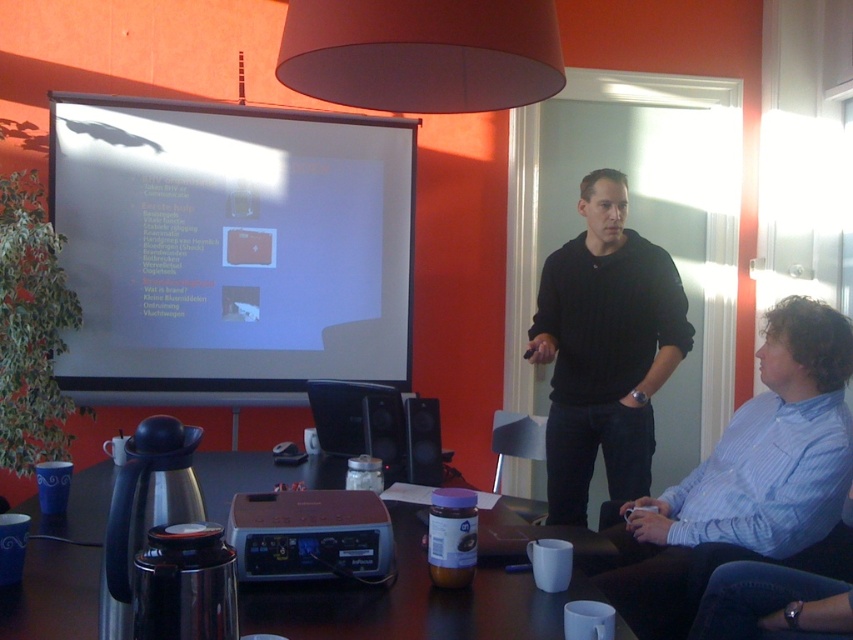
Does blue striped shirt at lower right appear under dark wood table at center?

No.

The width and height of the screenshot is (853, 640). What do you see at coordinates (746, 477) in the screenshot? I see `blue striped shirt at lower right` at bounding box center [746, 477].

Where is `blue striped shirt at lower right`? blue striped shirt at lower right is located at coordinates (746, 477).

Find the location of a particular element. This screenshot has width=853, height=640. dark wood table at center is located at coordinates (410, 602).

Between point (431, 588) and point (428, 432), which one is positioned in front?

Point (431, 588) is in front.

Image resolution: width=853 pixels, height=640 pixels. In order to click on dark wood table at center in this screenshot , I will do `click(410, 602)`.

Can you confirm if dark wood table at center is positioned to the right of black cotton hoodie at center?

Incorrect, dark wood table at center is not on the right side of black cotton hoodie at center.

Does dark wood table at center have a greater height compared to black cotton hoodie at center?

In fact, dark wood table at center may be shorter than black cotton hoodie at center.

You are a GUI agent. You are given a task and a screenshot of the screen. Output one action in this format:
    pyautogui.click(x=<x>, y=<y>)
    Task: Click on the dark wood table at center
    The width and height of the screenshot is (853, 640).
    Given the screenshot: What is the action you would take?
    pos(410,602)